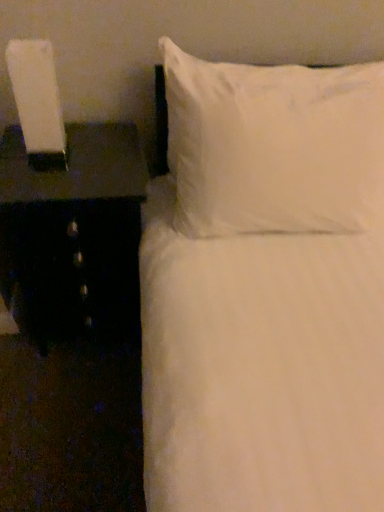
Question: Is white glossy lamp at left smaller than white soft pillow at upper right?

Choices:
 (A) no
 (B) yes

Answer: (B)

Question: Can you confirm if white glossy lamp at left is positioned to the left of white soft pillow at upper right?

Choices:
 (A) yes
 (B) no

Answer: (A)

Question: Would you say white soft pillow at upper right is part of white glossy lamp at left's contents?

Choices:
 (A) yes
 (B) no

Answer: (B)

Question: Does white glossy lamp at left turn towards white soft pillow at upper right?

Choices:
 (A) no
 (B) yes

Answer: (A)

Question: Is white glossy lamp at left thinner than white soft pillow at upper right?

Choices:
 (A) yes
 (B) no

Answer: (A)

Question: In terms of height, does white glossy lamp at left look taller or shorter compared to black glossy nightstand at left?

Choices:
 (A) tall
 (B) short

Answer: (B)

Question: Visually, is white glossy lamp at left positioned to the left or to the right of black glossy nightstand at left?

Choices:
 (A) left
 (B) right

Answer: (A)

Question: Is white glossy lamp at left inside or outside of black glossy nightstand at left?

Choices:
 (A) outside
 (B) inside

Answer: (A)

Question: From a real-world perspective, is white glossy lamp at left physically located above or below black glossy nightstand at left?

Choices:
 (A) above
 (B) below

Answer: (A)

Question: Does point (96, 289) appear closer or farther from the camera than point (344, 221)?

Choices:
 (A) farther
 (B) closer

Answer: (A)

Question: Is black glossy nightstand at left taller or shorter than white soft pillow at upper right?

Choices:
 (A) short
 (B) tall

Answer: (B)

Question: Is black glossy nightstand at left bigger or smaller than white soft pillow at upper right?

Choices:
 (A) big
 (B) small

Answer: (B)

Question: Considering the positions of black glossy nightstand at left and white soft pillow at upper right in the image, is black glossy nightstand at left wider or thinner than white soft pillow at upper right?

Choices:
 (A) wide
 (B) thin

Answer: (A)

Question: From the image's perspective, is black glossy nightstand at left above or below white glossy lamp at left?

Choices:
 (A) above
 (B) below

Answer: (B)

Question: Which is correct: black glossy nightstand at left is inside white glossy lamp at left, or outside of it?

Choices:
 (A) outside
 (B) inside

Answer: (A)